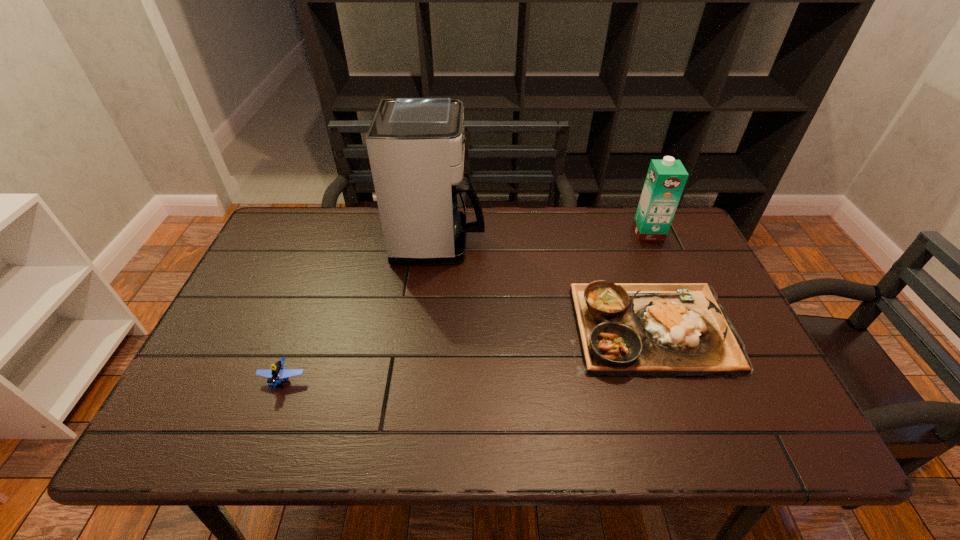
The width and height of the screenshot is (960, 540). Identify the location of the tallest object. (416, 146).

The width and height of the screenshot is (960, 540). I want to click on the second object from left to right, so click(x=416, y=146).

Find the location of `carton`. carton is located at coordinates (665, 181).

Find the location of a particular element. The height and width of the screenshot is (540, 960). platter is located at coordinates (663, 330).

I want to click on Lego, so click(274, 376).

Identify the location of the leftmost object. (274, 376).

Where is `free region located on the front panel of the third object from right to left`? The height and width of the screenshot is (540, 960). free region located on the front panel of the third object from right to left is located at coordinates (607, 241).

Image resolution: width=960 pixels, height=540 pixels. Find the location of `free space located 0.290m on the left of the carton`. free space located 0.290m on the left of the carton is located at coordinates (543, 232).

At what (x,y) coordinates should I click in order to perform the action: click on vacant space located on the back of the third tallest object. Please return your answer as a coordinate pair (x, y). Looking at the image, I should click on (622, 249).

This screenshot has width=960, height=540. I want to click on vacant space situated on the front-facing side of the Lego, so click(269, 417).